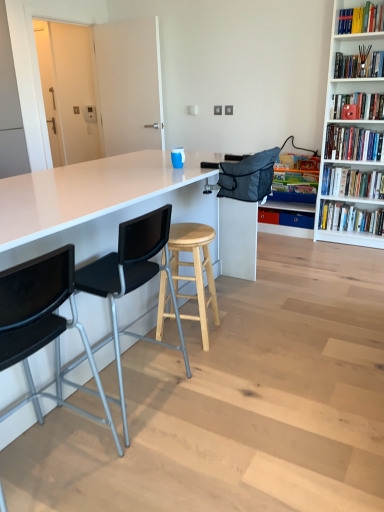
Locate an element on the screen. The width and height of the screenshot is (384, 512). empty space that is to the right of natural wood stool at center is located at coordinates (242, 330).